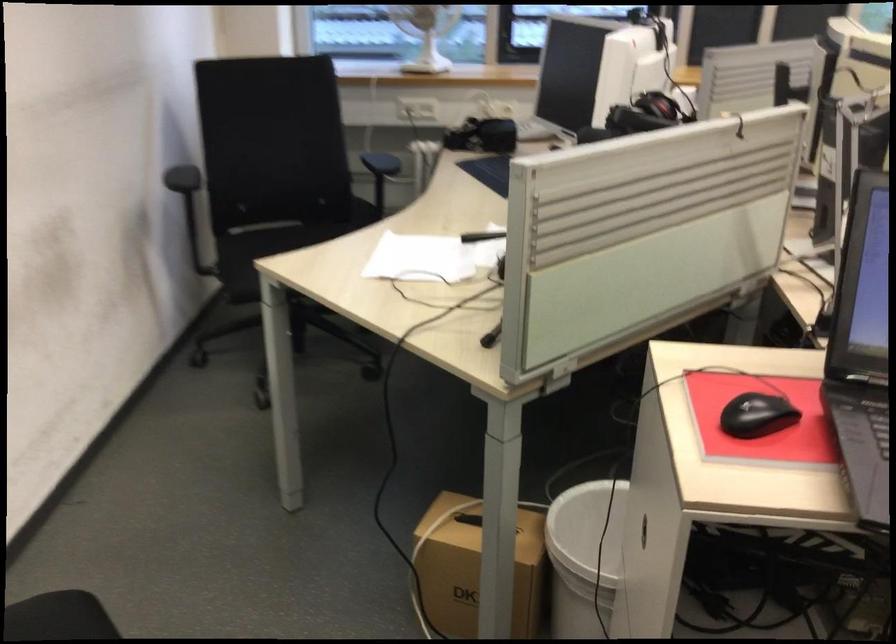
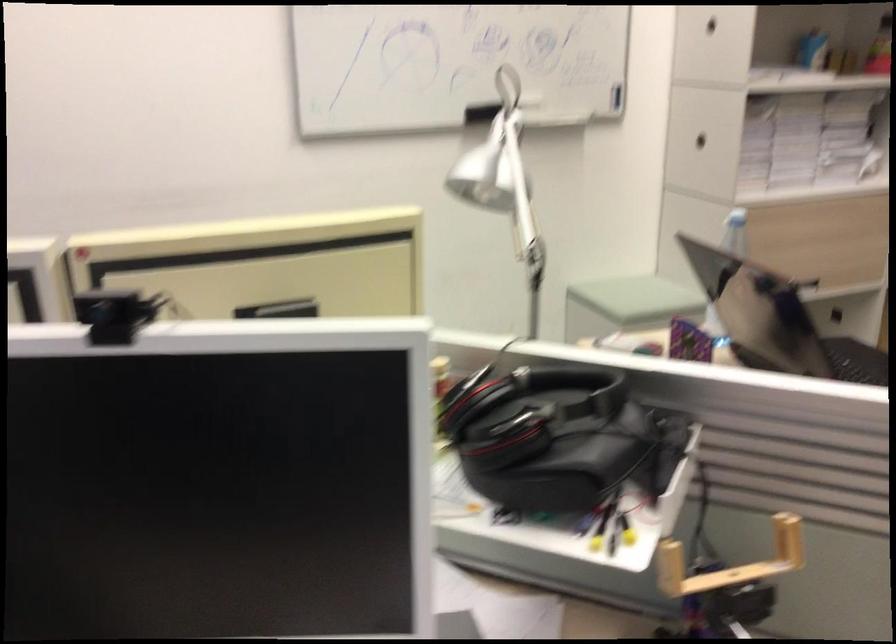
In the second image, find the point that corresponds to point 621,303 in the first image.

(730, 562)